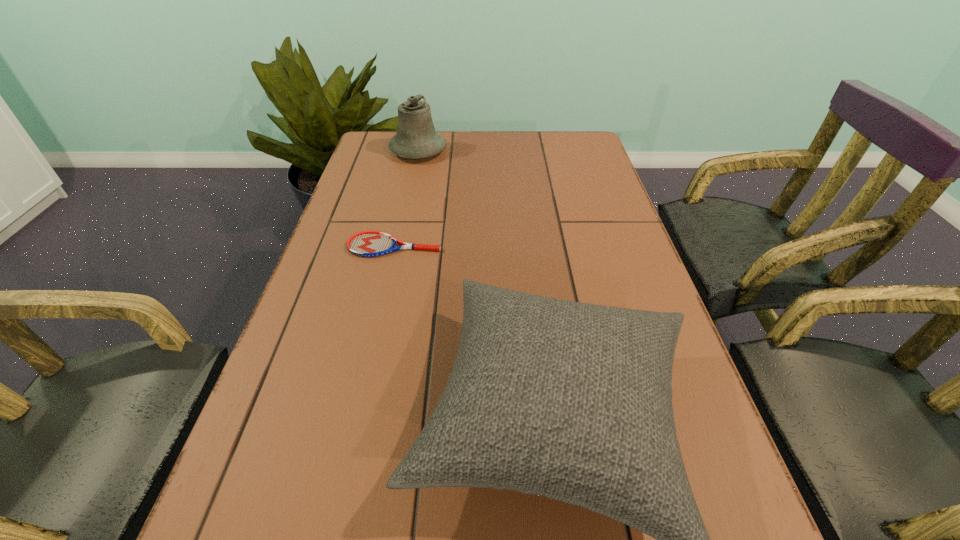
This screenshot has width=960, height=540. What are the coordinates of `the farthest object` in the screenshot? It's located at [x=416, y=137].

Where is `the second farthest object`? the second farthest object is located at coordinates (367, 243).

Locate an element on the screen. tennis racket is located at coordinates (367, 243).

You are a GUI agent. You are given a task and a screenshot of the screen. Output one action in this format:
    pyautogui.click(x=<x>, y=<y>)
    Task: Click on the vacant region located on the front of the bell
    The width and height of the screenshot is (960, 540).
    Given the screenshot: What is the action you would take?
    pyautogui.click(x=409, y=193)

At what (x,y) coordinates should I click in order to perform the action: click on free space located on the back of the tennis racket. Please return your answer as a coordinate pair (x, y). The width and height of the screenshot is (960, 540). Looking at the image, I should click on (405, 197).

The width and height of the screenshot is (960, 540). Find the location of `object that is at the far edge`. object that is at the far edge is located at coordinates (416, 137).

Identify the location of bell present at the left edge. (416, 137).

The image size is (960, 540). What are the coordinates of `tennis racket at the left edge` in the screenshot? It's located at (367, 243).

This screenshot has width=960, height=540. What are the coordinates of `object that is at the far left corner` in the screenshot? It's located at (416, 137).

Find the location of a particular element. vacant area at the far edge is located at coordinates [514, 165].